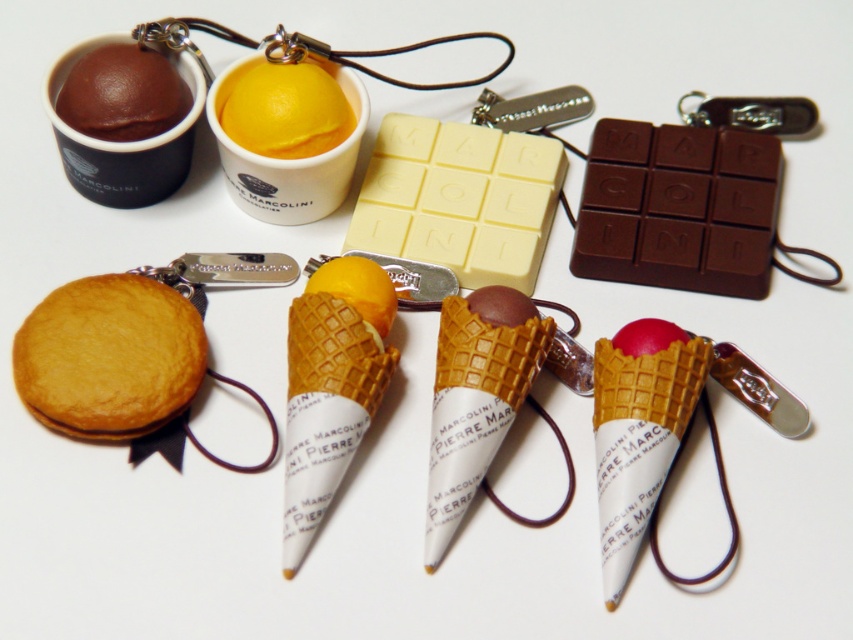
Does golden matte cookie at lower left appear under yellow matte ice cream cone at center?

Actually, golden matte cookie at lower left is above yellow matte ice cream cone at center.

Image resolution: width=853 pixels, height=640 pixels. Describe the element at coordinates (109, 356) in the screenshot. I see `golden matte cookie at lower left` at that location.

At what (x,y) coordinates should I click in order to perform the action: click on golden matte cookie at lower left. Please return your answer as a coordinate pair (x, y). This screenshot has width=853, height=640. Looking at the image, I should click on (109, 356).

Does matte pink ice cream at center come behind chocolate matte ice cream cone at center?

No, it is in front of chocolate matte ice cream cone at center.

Measure the distance between point (634,339) and camera.

A distance of 4.19 feet exists between point (634,339) and camera.

What do you see at coordinates (637, 433) in the screenshot? I see `matte pink ice cream at center` at bounding box center [637, 433].

I want to click on matte pink ice cream at center, so click(x=637, y=433).

Who is more forward, (x=195, y=316) or (x=106, y=97)?

Positioned in front is point (x=106, y=97).

Can you confirm if golden matte cookie at lower left is shorter than matte brown chocolate at upper left?

Incorrect, golden matte cookie at lower left's height does not fall short of matte brown chocolate at upper left's.

The width and height of the screenshot is (853, 640). Find the location of `golden matte cookie at lower left`. golden matte cookie at lower left is located at coordinates (109, 356).